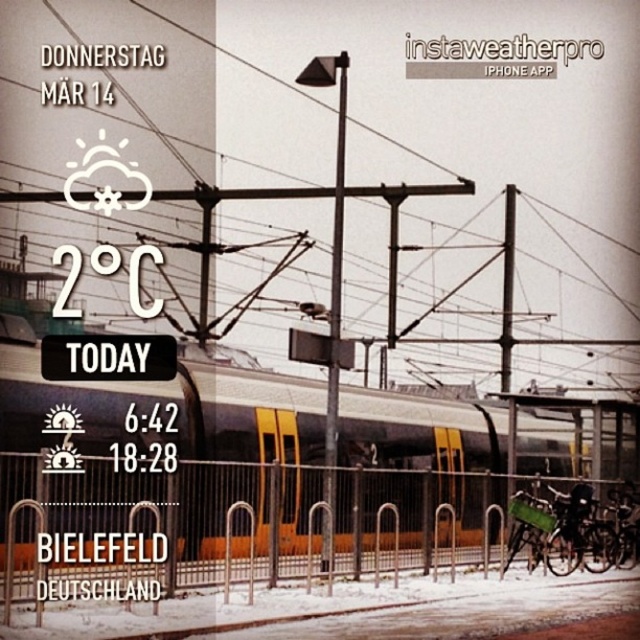
Question: Which point is farther to the camera?

Choices:
 (A) metallic silver fence at lower center
 (B) metallic silver train at center
 (C) metallic pole at center

Answer: (C)

Question: Can you confirm if metallic silver train at center is smaller than metallic pole at center?

Choices:
 (A) yes
 (B) no

Answer: (B)

Question: Which of the following is the closest to the observer?

Choices:
 (A) metallic silver train at center
 (B) metallic silver fence at lower center

Answer: (B)

Question: Does metallic silver fence at lower center appear under metallic silver train at center?

Choices:
 (A) yes
 (B) no

Answer: (A)

Question: Which object is closer to the camera taking this photo?

Choices:
 (A) metallic pole at center
 (B) metallic silver fence at lower center
 (C) metallic silver train at center

Answer: (B)

Question: Considering the relative positions of metallic silver train at center and metallic pole at center in the image provided, where is metallic silver train at center located with respect to metallic pole at center?

Choices:
 (A) below
 (B) above

Answer: (A)